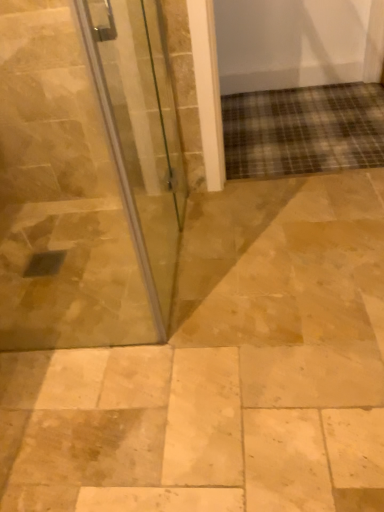
Question: Visually, is transparent glass door at left positioned to the left or to the right of natural stone tile at center?

Choices:
 (A) right
 (B) left

Answer: (B)

Question: From the image's perspective, relative to natural stone tile at center, is transparent glass door at left above or below?

Choices:
 (A) above
 (B) below

Answer: (A)

Question: Do you think transparent glass door at left is within natural stone tile at center, or outside of it?

Choices:
 (A) inside
 (B) outside

Answer: (B)

Question: Based on their sizes in the image, would you say natural stone tile at center is bigger or smaller than transparent glass door at left?

Choices:
 (A) small
 (B) big

Answer: (B)

Question: From a real-world perspective, is natural stone tile at center physically located above or below transparent glass door at left?

Choices:
 (A) above
 (B) below

Answer: (B)

Question: Does point tap(332, 202) appear closer or farther from the camera than point tap(92, 12)?

Choices:
 (A) closer
 (B) farther

Answer: (B)

Question: Is natural stone tile at center wider or thinner than transparent glass door at left?

Choices:
 (A) wide
 (B) thin

Answer: (A)